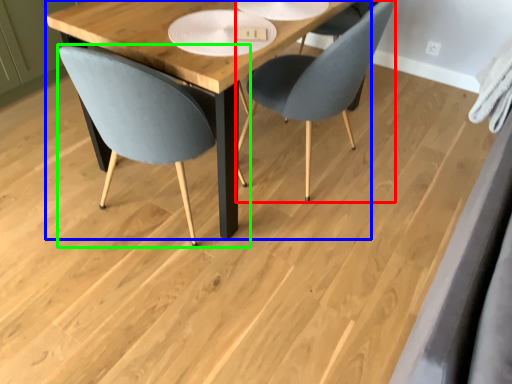
Question: Estimate the real-world distances between objects in this image. Which object is farther from chair (highlighted by a red box), table (highlighted by a blue box) or chair (highlighted by a green box)?

Choices:
 (A) table
 (B) chair

Answer: (B)